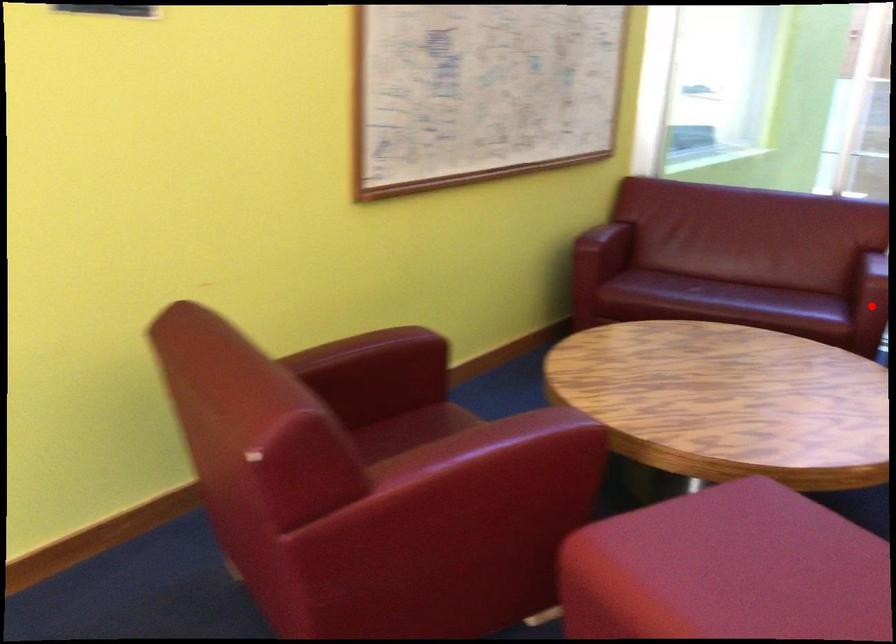
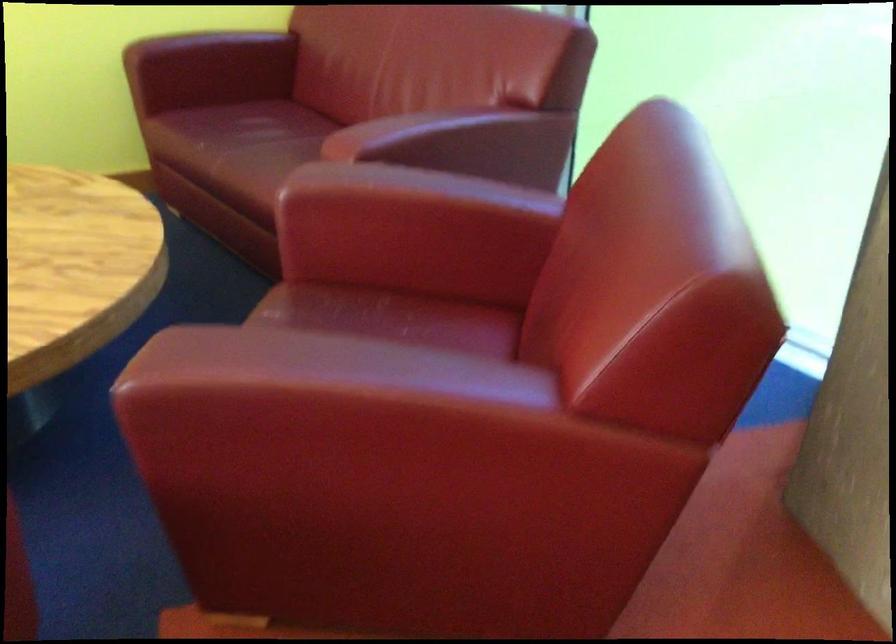
Question: I am providing you with two images of the same scene from different viewpoints. A red point is marked on the first image. Can you still see the location of the red point in image 2?

Choices:
 (A) Yes
 (B) No

Answer: (B)